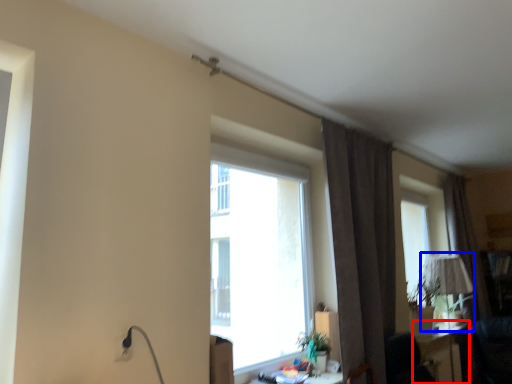
Question: Which point is further to the camera, table (highlighted by a red box) or table lamp (highlighted by a blue box)?

Choices:
 (A) table
 (B) table lamp

Answer: (B)